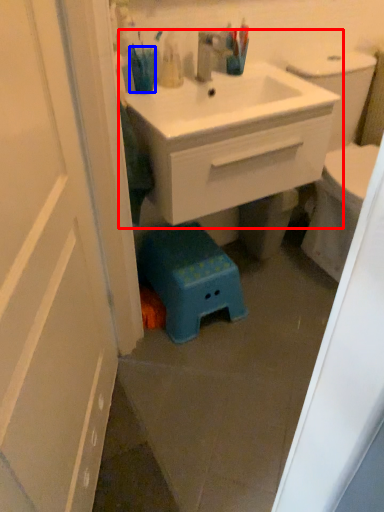
Question: Which point is closer to the camera, bathroom cabinet (highlighted by a red box) or teal (highlighted by a blue box)?

Choices:
 (A) bathroom cabinet
 (B) teal

Answer: (A)